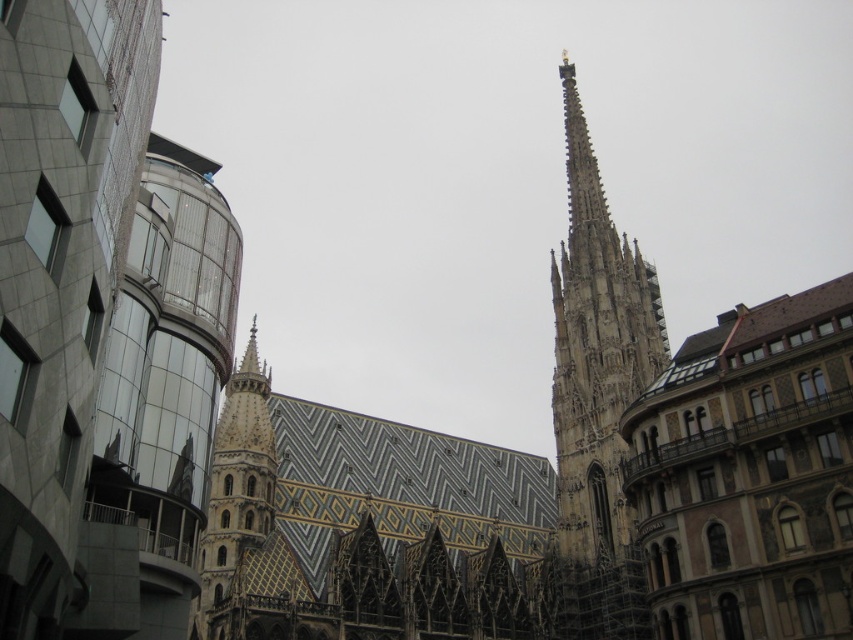
Question: Is stone spire at upper right below golden mosaic tower at center?

Choices:
 (A) no
 (B) yes

Answer: (A)

Question: Where is stone spire at upper right located in relation to golden mosaic tower at center in the image?

Choices:
 (A) left
 (B) right

Answer: (B)

Question: Which point is closer to the camera taking this photo?

Choices:
 (A) (228, 497)
 (B) (634, 564)

Answer: (A)

Question: Does stone spire at upper right appear under golden mosaic tower at center?

Choices:
 (A) no
 (B) yes

Answer: (A)

Question: Among these objects, which one is farthest from the camera?

Choices:
 (A) golden mosaic tower at center
 (B) stone spire at upper right

Answer: (B)